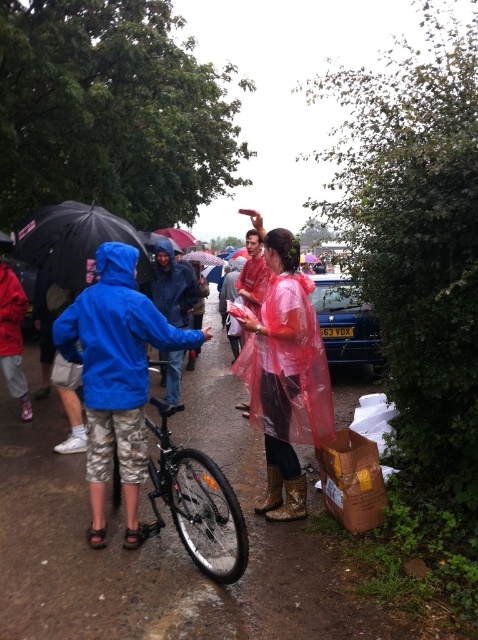
Question: Does transparent plastic raincoat at center appear under black matte bicycle at center?

Choices:
 (A) no
 (B) yes

Answer: (A)

Question: Can you confirm if black matte bicycle at center is positioned to the right of black matte umbrella at left?

Choices:
 (A) yes
 (B) no

Answer: (A)

Question: Which object is closer to the camera taking this photo?

Choices:
 (A) blue matte jacket at center
 (B) black matte bicycle at center

Answer: (B)

Question: Can you confirm if blue metallic car at center is positioned to the left of transparent plastic umbrella at center?

Choices:
 (A) no
 (B) yes

Answer: (A)

Question: Which point is closer to the camera taking this photo?

Choices:
 (A) (154, 424)
 (B) (110, 429)

Answer: (B)

Question: Which of the following is the farthest from the observer?

Choices:
 (A) (167, 349)
 (B) (336, 358)
 (C) (293, 280)

Answer: (B)